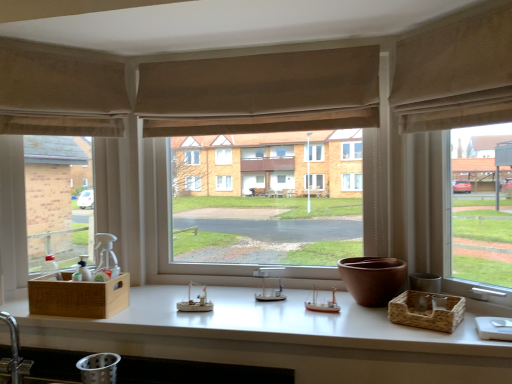
Question: From the image's perspective, is brown woven basket at right, the 2th basket from the left, on top of white matte countertop at center?

Choices:
 (A) yes
 (B) no

Answer: (A)

Question: Is brown woven basket at right, which is the 1th basket from right to left, not close to white matte countertop at center?

Choices:
 (A) no
 (B) yes

Answer: (A)

Question: From a real-world perspective, is brown woven basket at right, which is the 1th basket from right to left, below white matte countertop at center?

Choices:
 (A) yes
 (B) no

Answer: (B)

Question: Can you confirm if brown woven basket at right, which is the 1th basket from right to left, is wider than white matte countertop at center?

Choices:
 (A) yes
 (B) no

Answer: (B)

Question: From a real-world perspective, is brown woven basket at right, which is the 1th basket from right to left, over white matte countertop at center?

Choices:
 (A) yes
 (B) no

Answer: (A)

Question: In the image, is beige fabric curtain at upper right, arranged as the first curtain when viewed from the right, positioned in front of or behind wooden crate at left, which is the 1th window in left-to-right order?

Choices:
 (A) behind
 (B) front

Answer: (B)

Question: Which is correct: beige fabric curtain at upper right, the 1th curtain when ordered from front to back, is inside wooden crate at left, the third window from the right, or outside of it?

Choices:
 (A) outside
 (B) inside

Answer: (A)

Question: From a real-world perspective, is beige fabric curtain at upper right, arranged as the first curtain when viewed from the right, positioned above or below wooden crate at left, the third window from the right?

Choices:
 (A) above
 (B) below

Answer: (A)

Question: Considering the positions of beige fabric curtain at upper right, placed as the second curtain when sorted from left to right, and wooden crate at left, the third window from the right, in the image, is beige fabric curtain at upper right, placed as the second curtain when sorted from left to right, taller or shorter than wooden crate at left, the third window from the right,?

Choices:
 (A) short
 (B) tall

Answer: (A)

Question: From the image's perspective, is matte beige curtain at center, placed as the 2th window when sorted from right to left, located above or below wooden crate at left, the third window from the right?

Choices:
 (A) below
 (B) above

Answer: (B)

Question: In terms of width, does matte beige curtain at center, acting as the 2th window starting from the left, look wider or thinner when compared to wooden crate at left, the third window from the right?

Choices:
 (A) wide
 (B) thin

Answer: (B)

Question: Is matte beige curtain at center, acting as the 2th window starting from the left, in front of or behind wooden crate at left, the third window from the right, in the image?

Choices:
 (A) front
 (B) behind

Answer: (B)

Question: In terms of height, does matte beige curtain at center, acting as the 2th window starting from the left, look taller or shorter compared to wooden crate at left, which is the 1th window in left-to-right order?

Choices:
 (A) tall
 (B) short

Answer: (A)

Question: In terms of height, does beige fabric curtain at upper right, arranged as the first curtain when viewed from the right, look taller or shorter compared to white matte countertop at center?

Choices:
 (A) short
 (B) tall

Answer: (B)

Question: From the image's perspective, is beige fabric curtain at upper right, arranged as the first curtain when viewed from the right, above or below white matte countertop at center?

Choices:
 (A) above
 (B) below

Answer: (A)